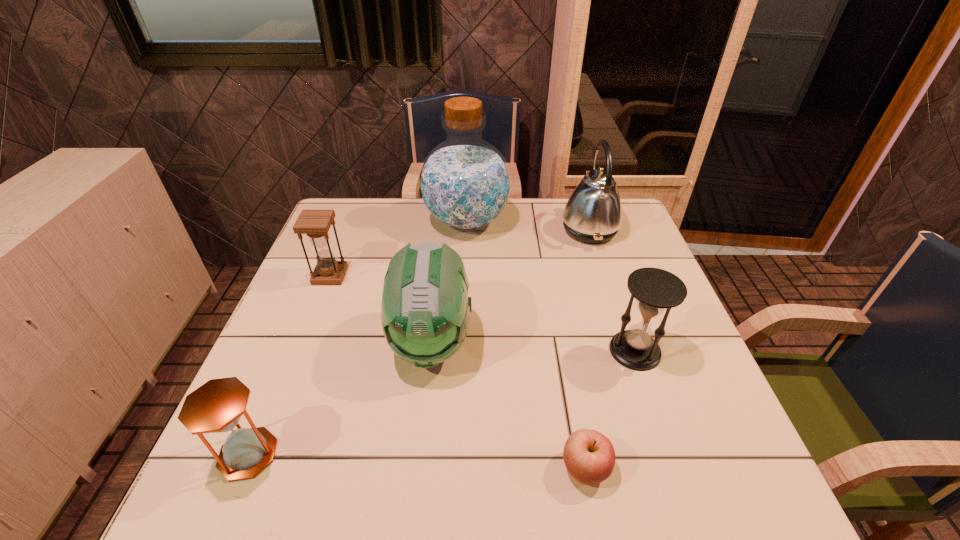
Locate an element on the screen. Image resolution: width=960 pixels, height=540 pixels. free location that satisfies the following two spatial constraints: 1. on the visor of the apple; 2. on the left side of the football helmet is located at coordinates (417, 468).